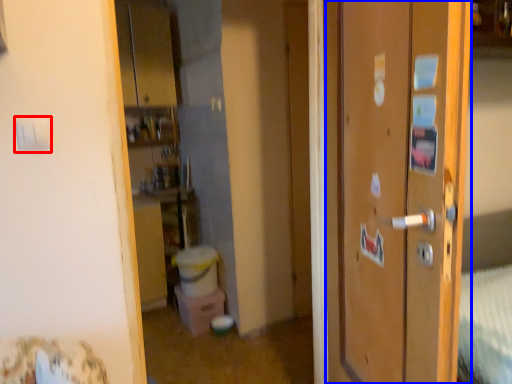
Question: Among these objects, which one is farthest to the camera, light switch (highlighted by a red box) or door (highlighted by a blue box)?

Choices:
 (A) light switch
 (B) door

Answer: (A)